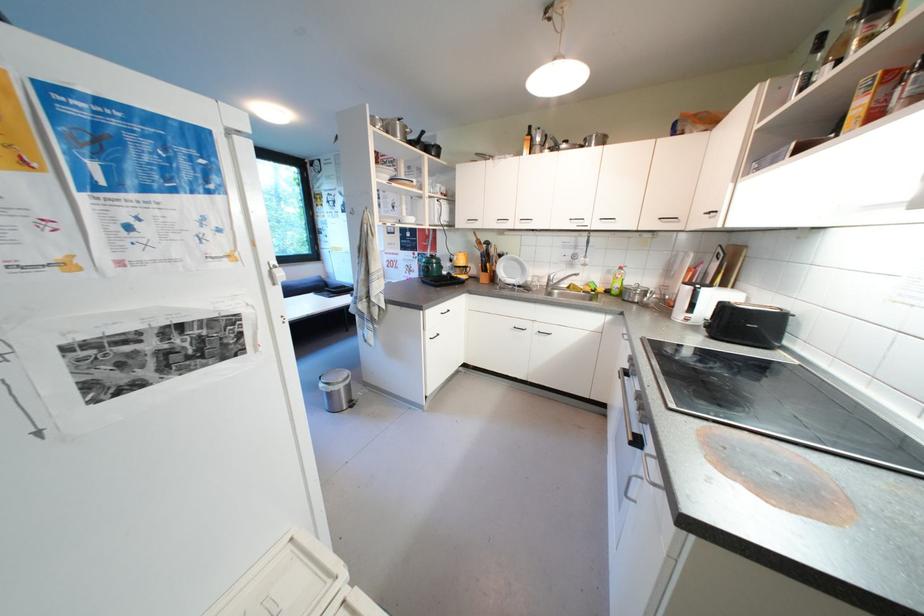
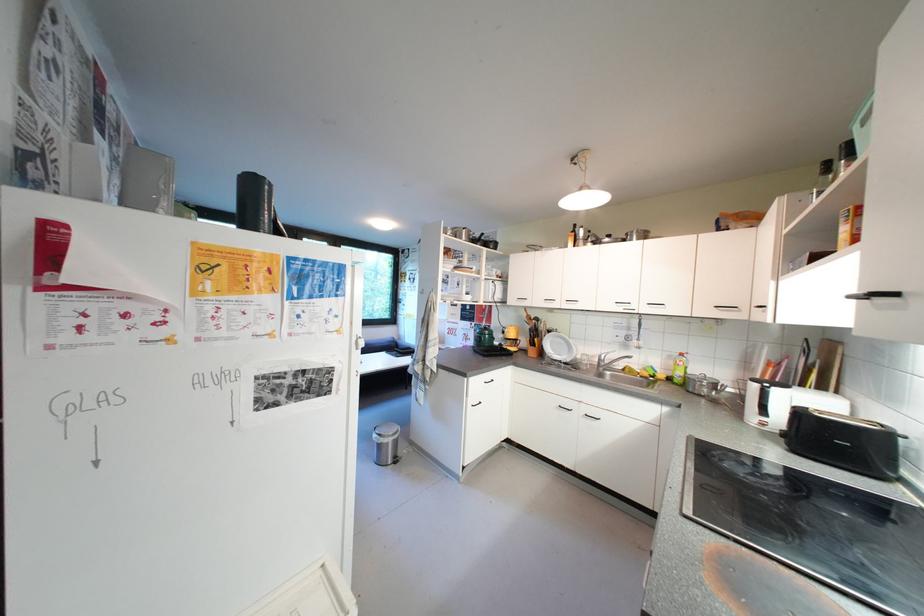
Question: The camera is either moving clockwise (left) or counter-clockwise (right) around the object. The first image is from the beginning of the video and the second image is from the end. Is the camera moving left or right when shooting the video?

Choices:
 (A) Left
 (B) Right

Answer: (B)